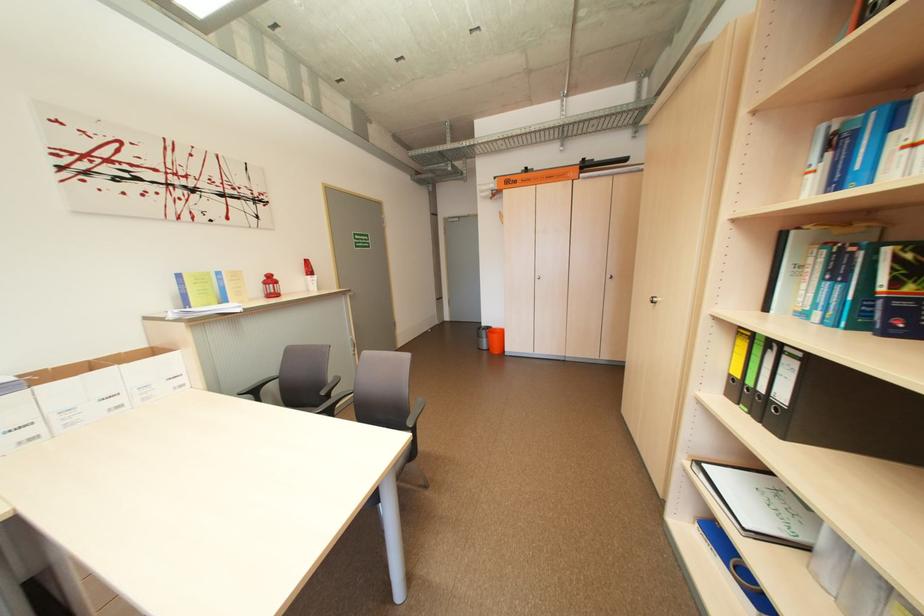
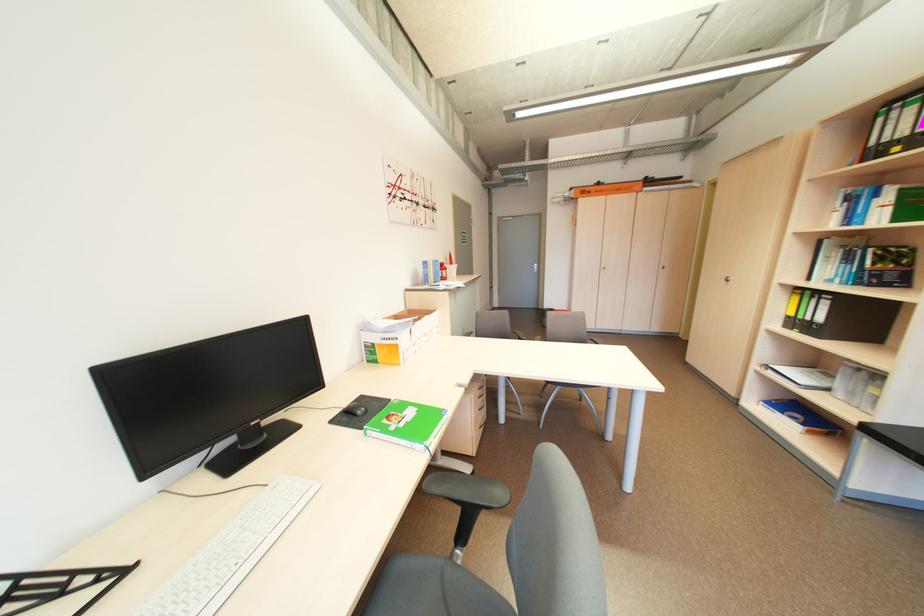
Question: I am providing you with two images of the same scene from different viewpoints. After the viewpoint changes to image2, which objects are now occluded?

Choices:
 (A) grey chair sitting surface
 (B) gray chair sitting surface
 (C) black chair armrest
 (D) capsule holder lid

Answer: (B)